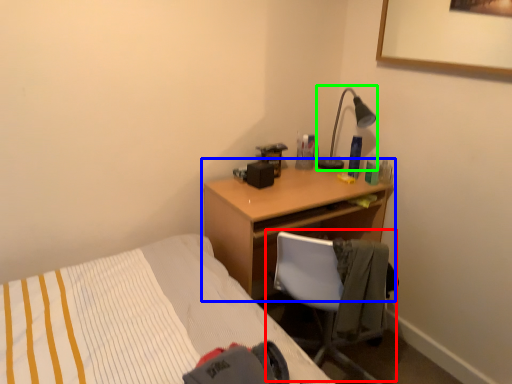
Question: Based on their relative distances, which object is nearer to chair (highlighted by a red box)? Choose from desk (highlighted by a blue box) and lamp (highlighted by a green box).

Choices:
 (A) desk
 (B) lamp

Answer: (A)